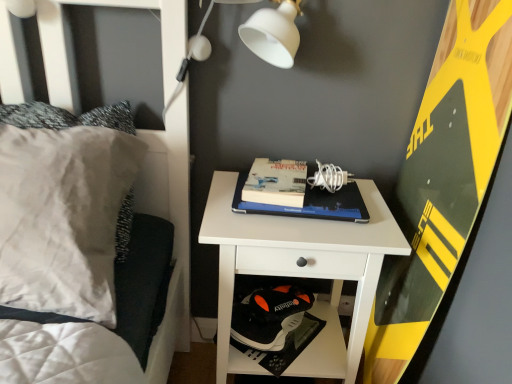
The width and height of the screenshot is (512, 384). Identify the location of free point above hardcover book at center, which is the 1th paperback book from left to right (from a real-world perspective). (278, 179).